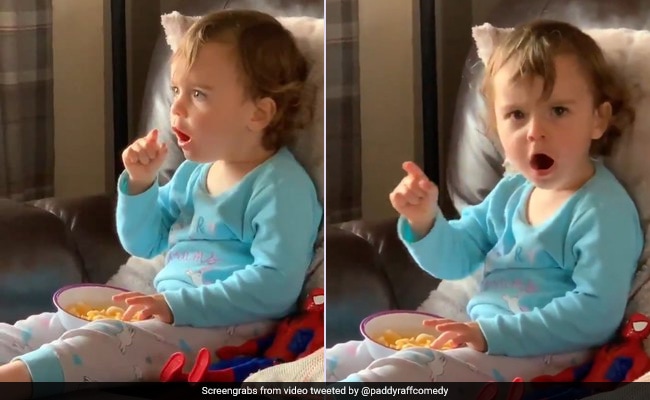
Where is `spiderman toy`? This screenshot has width=650, height=400. spiderman toy is located at coordinates (301, 331), (618, 360).